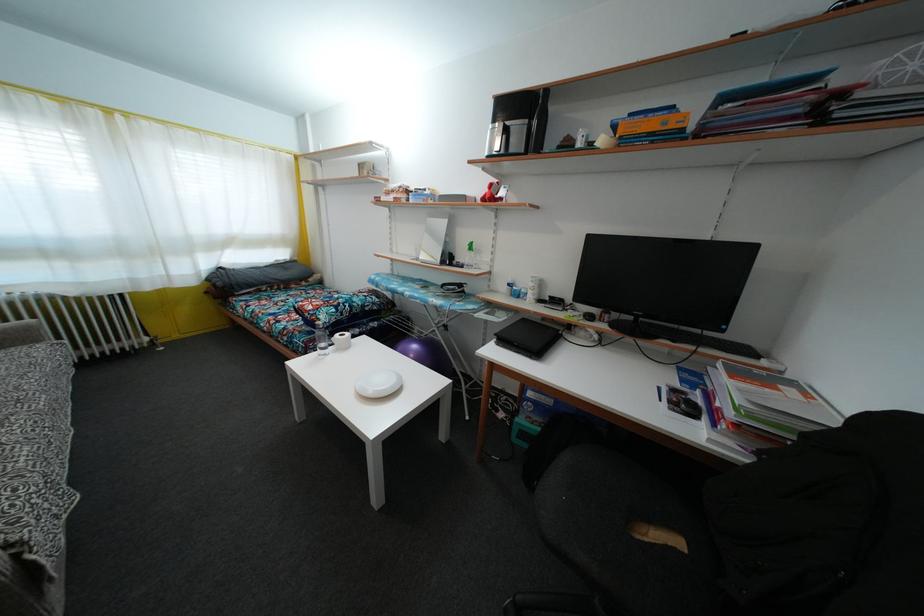
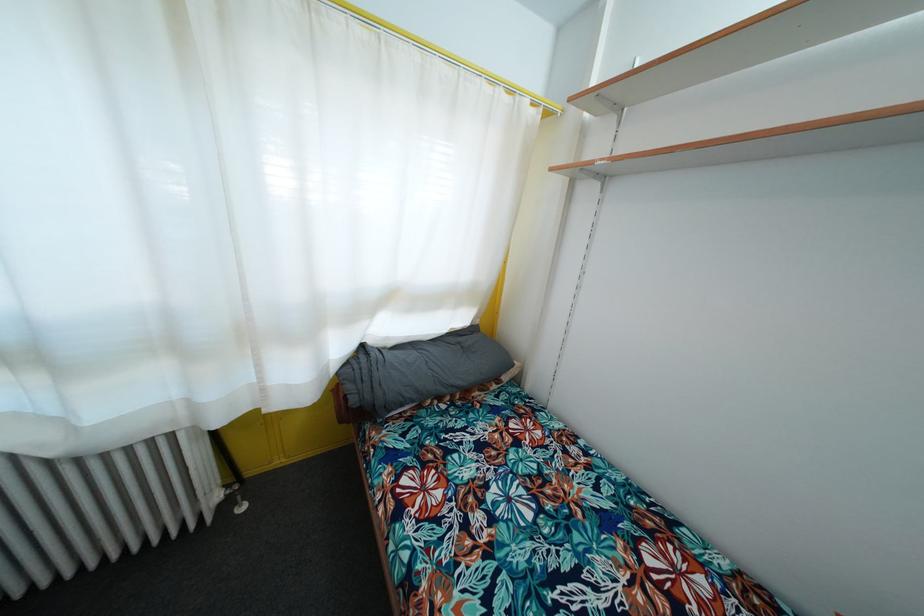
What movement of the cameraman would produce the second image?

The movement direction of the cameraman is left, forward.